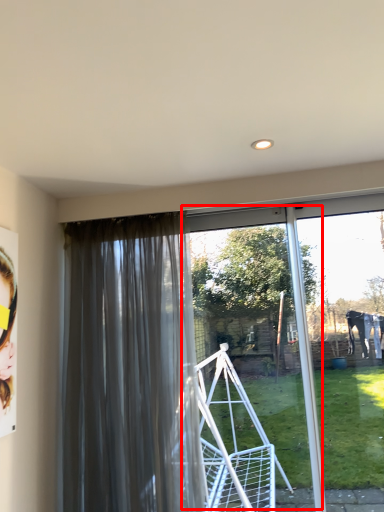
Question: From the image's perspective, where is screen door (annotated by the red box) located in relation to curtain in the image?

Choices:
 (A) above
 (B) below

Answer: (A)